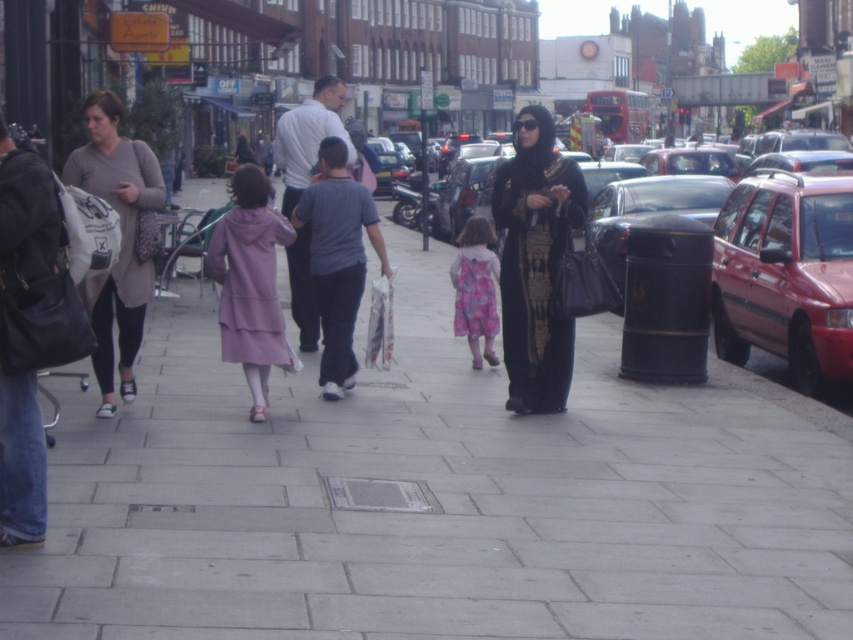
Question: In this image, where is black satin abaya at center located relative to pink floral dress at center?

Choices:
 (A) above
 (B) below

Answer: (A)

Question: From the image, what is the correct spatial relationship of gray concrete sidewalk at center in relation to metallic red station wagon at right?

Choices:
 (A) right
 (B) left

Answer: (B)

Question: Estimate the real-world distances between objects in this image. Which object is closer to the black satin abaya at center?

Choices:
 (A) pink floral dress at center
 (B) metallic red car at center right
 (C) gray concrete sidewalk at center
 (D) purple fabric coat at center

Answer: (A)

Question: Estimate the real-world distances between objects in this image. Which object is closer to the metallic red station wagon at right?

Choices:
 (A) black satin abaya at center
 (B) metallic red car at center right

Answer: (B)

Question: Which point is closer to the camera?

Choices:
 (A) (746, 216)
 (B) (809, 278)
 (C) (259, 401)
 (D) (358, 516)

Answer: (D)

Question: Is metallic red station wagon at right above purple fabric coat at center?

Choices:
 (A) no
 (B) yes

Answer: (A)